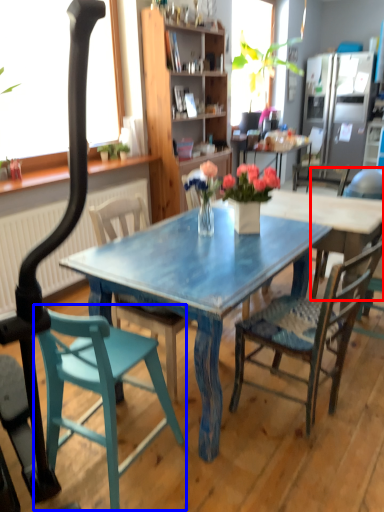
Question: Which point is further to the camera, chair (highlighted by a red box) or chair (highlighted by a blue box)?

Choices:
 (A) chair
 (B) chair

Answer: (A)